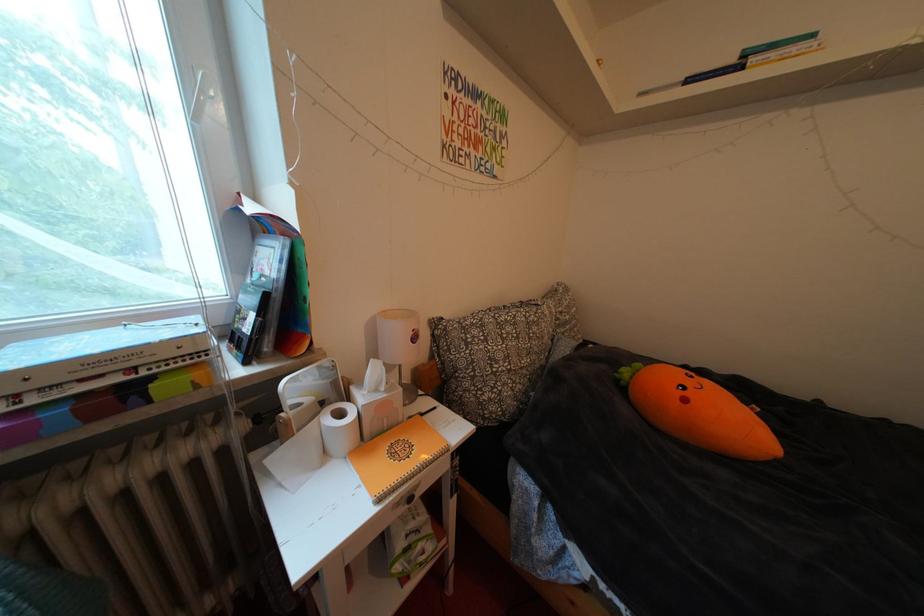
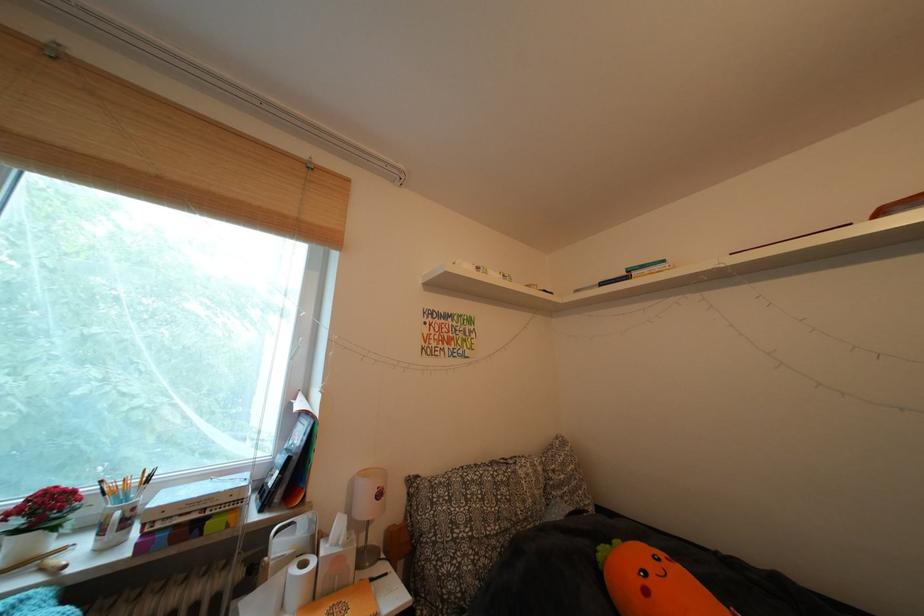
Find the pixel in the second image that matches the point at 351,450 in the first image.

(306, 602)